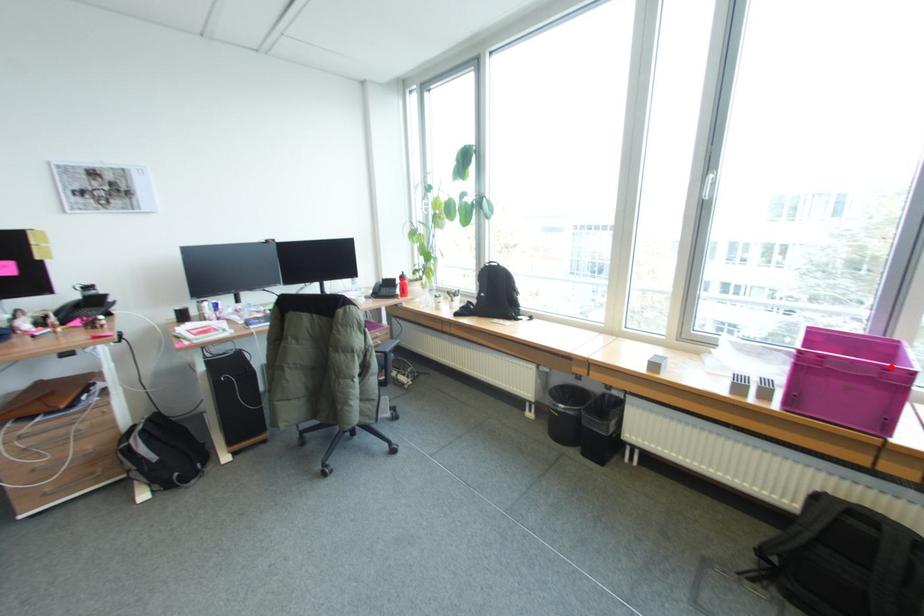
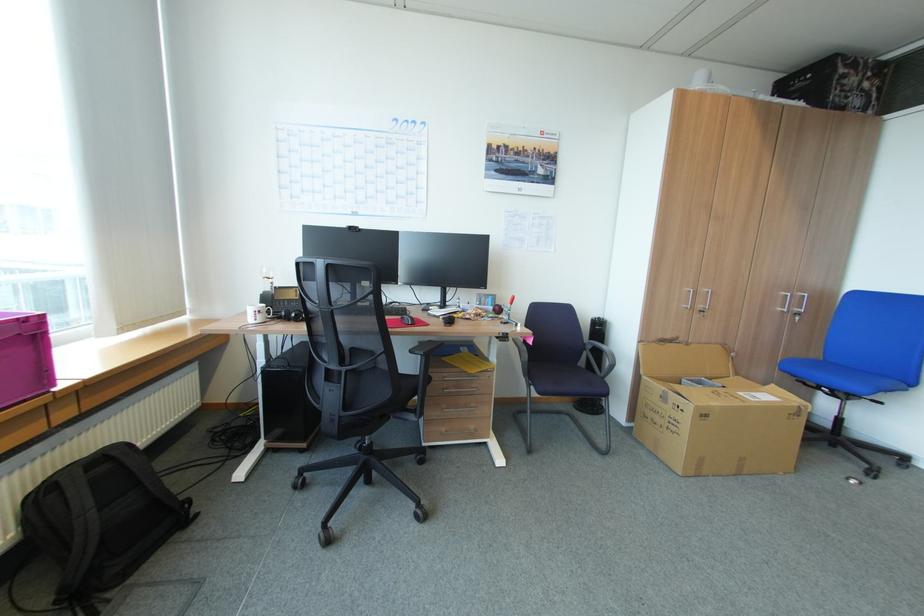
In the second image, find the point that corresponds to the highlighted location in the first image.

(29, 321)